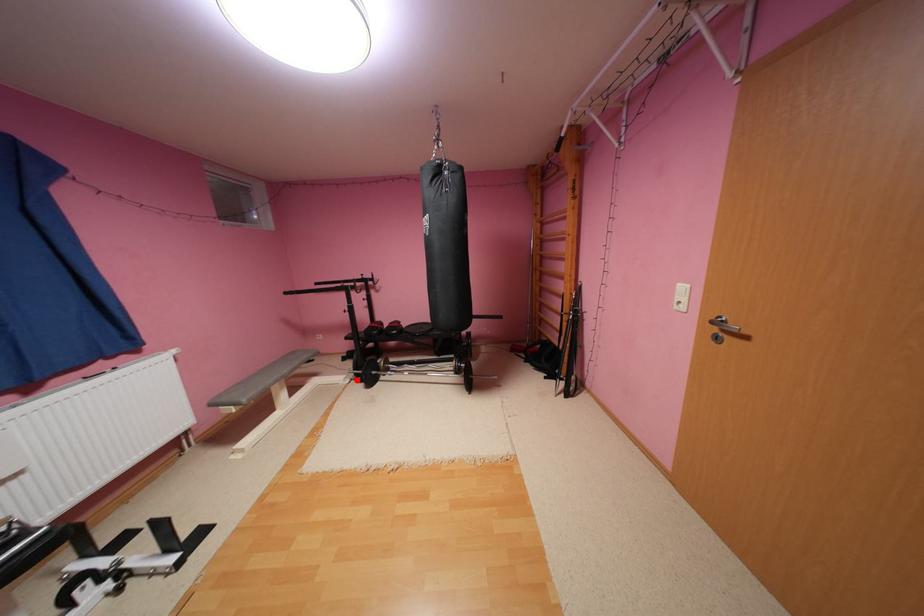
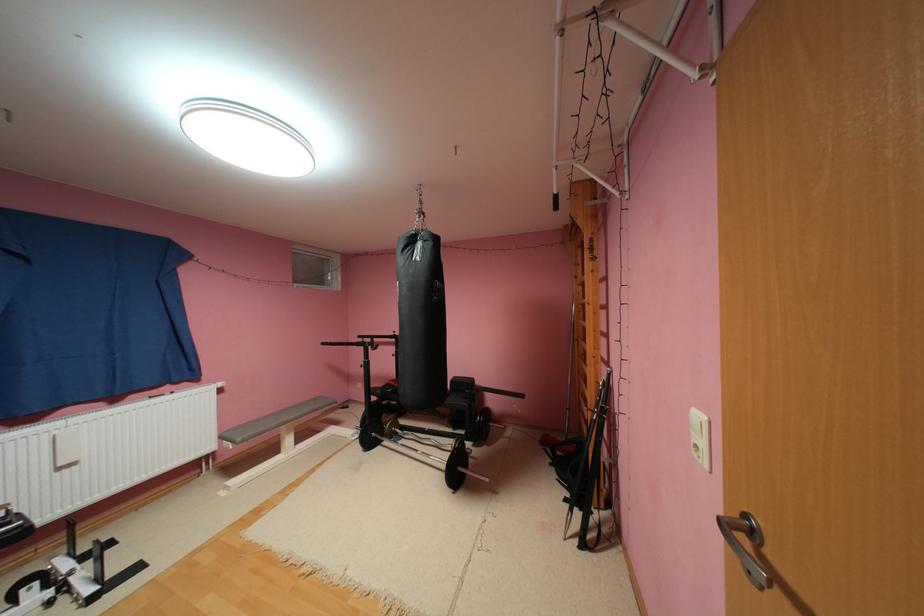
Locate, in the second image, the point that corresponds to the highlighted location in the first image.

(366, 436)